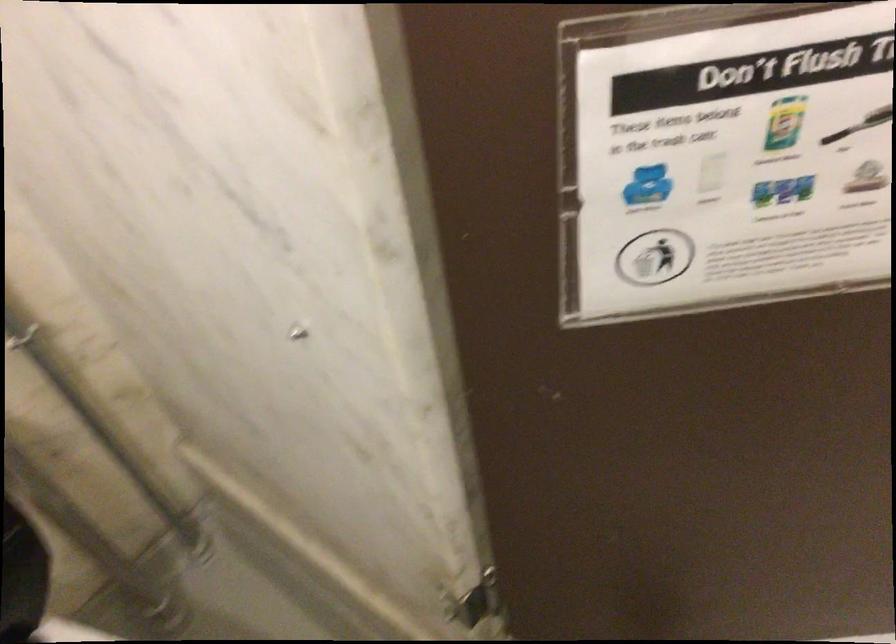
Find the location of a particular element. This screenshot has width=896, height=644. metal door latch is located at coordinates (476, 603).